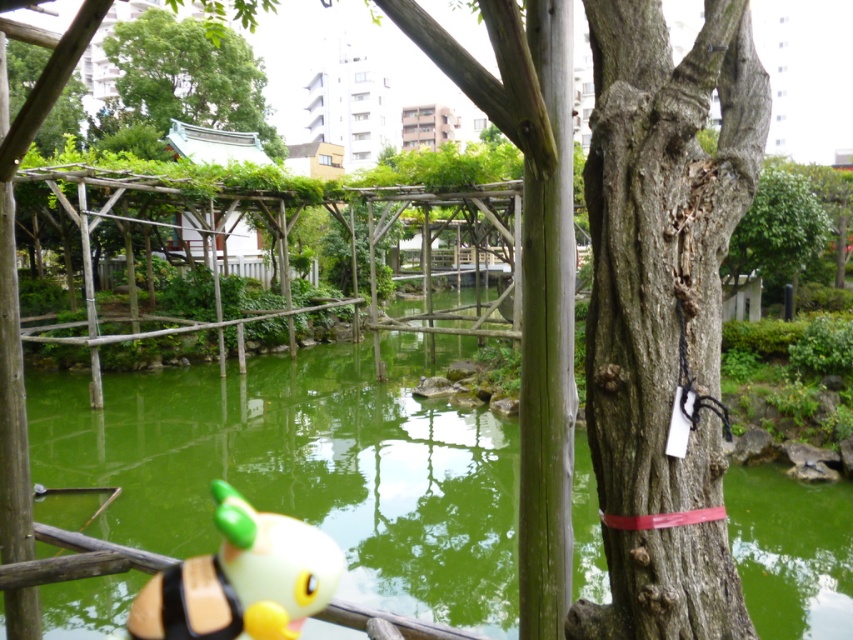
Question: Can you confirm if yellow matte toy at lower left is smaller than green leafy tree at upper left?

Choices:
 (A) yes
 (B) no

Answer: (A)

Question: Is gray rough bark tree trunk at center bigger than rough bark tree at upper right?

Choices:
 (A) no
 (B) yes

Answer: (B)

Question: Which object is closer to the camera taking this photo?

Choices:
 (A) smooth wooden pole at center
 (B) green leafy tree at upper left
 (C) rough bark tree at upper right

Answer: (A)

Question: Based on their relative distances, which object is farther from the green liquid water at center?

Choices:
 (A) smooth wooden pole at center
 (B) green leafy tree at upper left
 (C) yellow matte toy at lower left

Answer: (B)

Question: Does yellow matte toy at lower left have a larger size compared to green leafy tree at upper left?

Choices:
 (A) yes
 (B) no

Answer: (B)

Question: Which object is positioned closest to the green liquid water at center?

Choices:
 (A) smooth wooden pole at center
 (B) gray rough bark tree trunk at center
 (C) yellow matte toy at lower left
 (D) green leafy tree at upper left

Answer: (C)